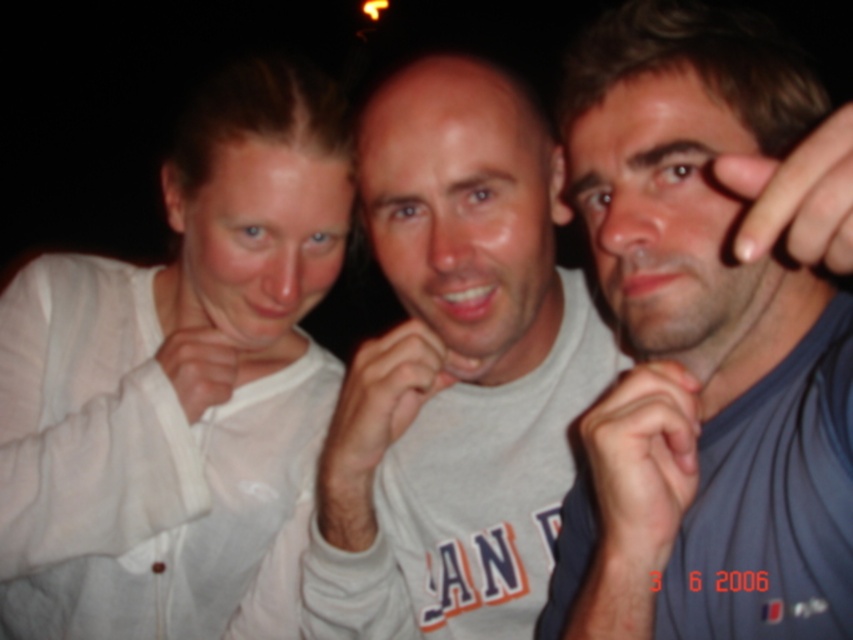
Question: Which object appears farthest from the camera in this image?

Choices:
 (A) nail polish at upper right
 (B) dark blue fabric hand at center

Answer: (B)

Question: Is gray cotton t-shirt at center wider than white matte hand at center?

Choices:
 (A) no
 (B) yes

Answer: (B)

Question: Does white matte hand at center appear over white fabric hand at center?

Choices:
 (A) no
 (B) yes

Answer: (A)

Question: Which object appears closest to the camera in this image?

Choices:
 (A) white fabric hand at center
 (B) gray cotton t-shirt at center
 (C) blue fabric shirt at right

Answer: (C)

Question: Which is farther from the white sheer shirt at left?

Choices:
 (A) blue fabric shirt at right
 (B) dark blue fabric hand at center
 (C) white matte hand at center

Answer: (B)

Question: Is white sheer shirt at left to the left of nail polish at upper right from the viewer's perspective?

Choices:
 (A) no
 (B) yes

Answer: (B)